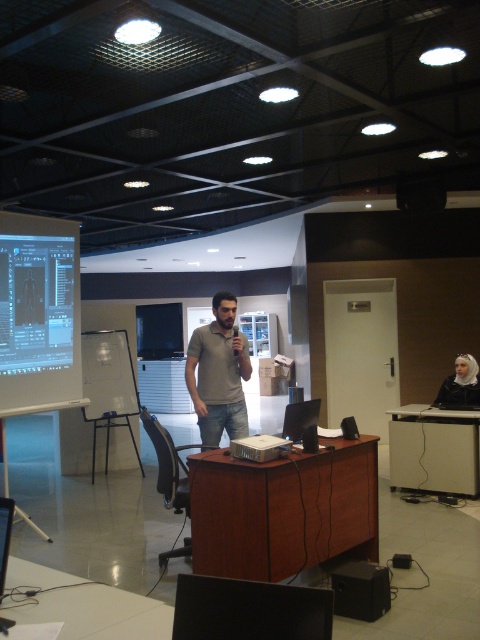
What are the coordinates of `brown wood table at center` in the screenshot? It's located at (284, 509).

Does brown wood table at center come in front of white glossy projector screen at left?

Yes, it is.

The image size is (480, 640). I want to click on brown wood table at center, so click(x=284, y=509).

Can you confirm if white glossy projector screen at left is positioned to the right of white fabric headscarf at upper right?

In fact, white glossy projector screen at left is to the left of white fabric headscarf at upper right.

From the picture: Does white glossy projector screen at left have a greater height compared to white fabric headscarf at upper right?

Yes, white glossy projector screen at left is taller than white fabric headscarf at upper right.

The height and width of the screenshot is (640, 480). Describe the element at coordinates (38, 314) in the screenshot. I see `white glossy projector screen at left` at that location.

Identify the location of white glossy projector screen at left. The width and height of the screenshot is (480, 640). (38, 314).

Which is behind, point (45, 396) or point (229, 369)?

Point (45, 396)

Is point (23, 307) in front of point (233, 301)?

No, it is behind (233, 301).

Is point (41, 248) closer to camera compared to point (204, 422)?

That is False.

Image resolution: width=480 pixels, height=640 pixels. Find the location of `white glossy projector screen at left`. white glossy projector screen at left is located at coordinates (38, 314).